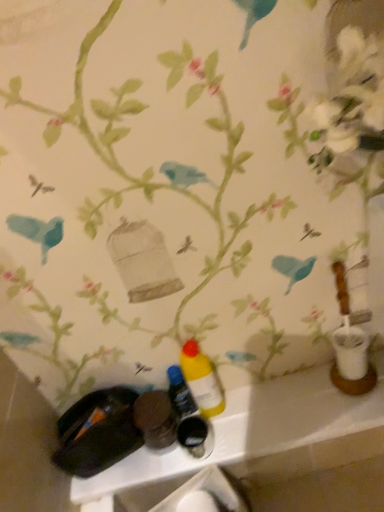
Find the location of a particular element. This screenshot has height=512, width=384. unoccupied area in front of yellow matte bottle at center, which ranks as the 1th bottle in right-to-left order is located at coordinates (241, 435).